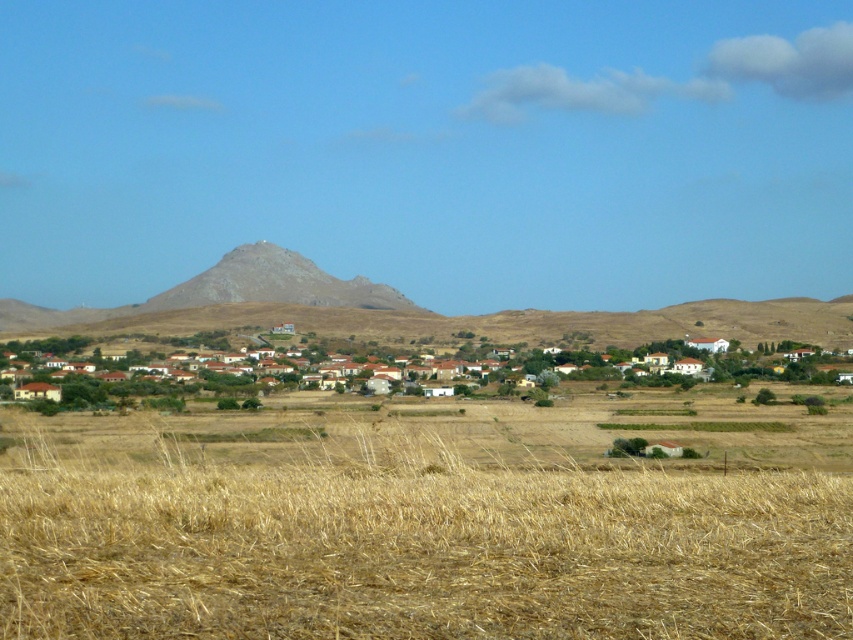
Is point (325, 636) closer to camera compared to point (287, 337)?

Yes, point (325, 636) is closer to viewer.

Where is `dry straw field at lower center`? The image size is (853, 640). dry straw field at lower center is located at coordinates (405, 541).